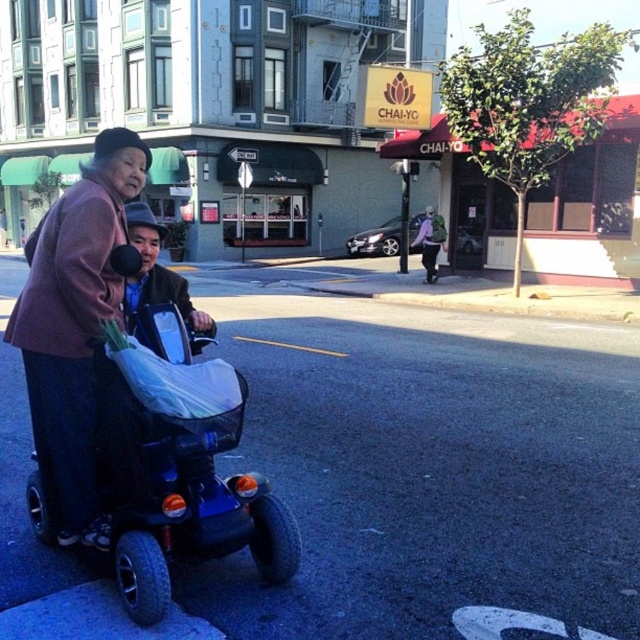
You are a delivery person who needs to place a package on the blue plastic scooter at lower left. The package is 20 inches long. Can you fit the package on the scooter without it overlapping with the dark purple fabric jacket at left?

The blue plastic scooter at lower left is 18.52 inches away from the dark purple fabric jacket at left. Since the package is 20 inches long, it would extend beyond the available space between the scooter and the jacket, so it cannot be placed there without overlapping.

Consider the image. You are a delivery person who needs to load a package onto the blue plastic scooter at lower left. The package is taller than the dark purple fabric jacket at left. Will the package fit on the scooter without exceeding its height?

The blue plastic scooter at lower left is not as tall as the dark purple fabric jacket at left. Since the package is taller than the jacket, it will exceed the scooter height and won